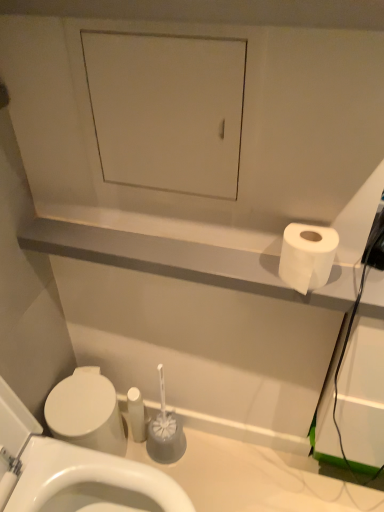
Image resolution: width=384 pixels, height=512 pixels. Identify the location of white matte toilet paper at right. (307, 256).

The height and width of the screenshot is (512, 384). Describe the element at coordinates (72, 472) in the screenshot. I see `white glossy toilet at lower left` at that location.

Where is `white matte toilet paper at right`? white matte toilet paper at right is located at coordinates [x=307, y=256].

Is white matte cabinet at upper center closer to camera compared to white glossy toilet at lower left?

No, white matte cabinet at upper center is further to the viewer.

How different are the orientations of white matte cabinet at upper center and white glossy toilet at lower left in degrees?

The angular difference between white matte cabinet at upper center and white glossy toilet at lower left is 90.8 degrees.

Which of these two, white matte cabinet at upper center or white glossy toilet at lower left, stands shorter?

white matte cabinet at upper center.

Measure the distance between white matte cabinet at upper center and white glossy toilet at lower left.

white matte cabinet at upper center and white glossy toilet at lower left are 26.21 inches apart from each other.

Is point (47, 451) positioned in front of point (179, 179)?

No, (47, 451) is behind (179, 179).

From a real-world perspective, between white glossy toilet at lower left and white matte cabinet at upper center, who is vertically lower?

From a 3D spatial view, white glossy toilet at lower left is below.

Who is shorter, white glossy toilet at lower left or white matte cabinet at upper center?

white matte cabinet at upper center.

Is white glossy toilet at lower left at the back of white matte toilet paper at right?

white matte toilet paper at right does not have its back to white glossy toilet at lower left.

From a real-world perspective, is white matte toilet paper at right below white glossy toilet at lower left?

No, from a real-world perspective, white matte toilet paper at right is not below white glossy toilet at lower left.

Is point (314, 258) closer or farther from the camera than point (125, 474)?

Point (314, 258) is closer to the camera than point (125, 474).

I want to click on toilet paper that is on the right side of white glossy toilet at lower left, so click(x=307, y=256).

Is white glossy toilet at lower left next to white matte toilet paper at right and touching it?

They are not placed beside each other.

Is white glossy toilet at lower left positioned with its back to white matte toilet paper at right?

No, white glossy toilet at lower left is not facing away from white matte toilet paper at right.

From a real-world perspective, which object rests below the other?

white glossy toilet at lower left, from a real-world perspective.

In terms of size, does white glossy toilet at lower left appear bigger or smaller than white matte toilet paper at right?

white glossy toilet at lower left is bigger than white matte toilet paper at right.

Can you see white matte cabinet at upper center touching white matte toilet paper at right?

No, white matte cabinet at upper center is not touching white matte toilet paper at right.

Considering their positions, is white matte cabinet at upper center located in front of or behind white matte toilet paper at right?

Clearly, white matte cabinet at upper center is in front of white matte toilet paper at right.

Considering the relative sizes of white matte cabinet at upper center and white matte toilet paper at right in the image provided, is white matte cabinet at upper center shorter than white matte toilet paper at right?

In fact, white matte cabinet at upper center may be taller than white matte toilet paper at right.

Considering the sizes of objects white matte toilet paper at right and white matte cabinet at upper center in the image provided, who is smaller, white matte toilet paper at right or white matte cabinet at upper center?

white matte toilet paper at right is smaller.

From the image's perspective, between white matte toilet paper at right and white matte cabinet at upper center, who is located below?

white matte toilet paper at right, from the image's perspective.

How different are the orientations of white matte toilet paper at right and white matte cabinet at upper center in degrees?

The angle between the facing direction of white matte toilet paper at right and the facing direction of white matte cabinet at upper center is 0.796 degrees.

Is white matte toilet paper at right closer to camera compared to white matte cabinet at upper center?

No, it is not.

At what (x,y) coordinates should I click in order to perform the action: click on medicine cabinet on the right of the white glossy toilet at lower left. Please return your answer as a coordinate pair (x, y). The height and width of the screenshot is (512, 384). Looking at the image, I should click on (167, 110).

What are the coordinates of `toilet located below the white matte cabinet at upper center (from the image's perspective)` in the screenshot? It's located at (72, 472).

When comparing their distances from white matte toilet paper at right, does white glossy toilet at lower left or white matte cabinet at upper center seem further?

Among the two, white glossy toilet at lower left is located further to white matte toilet paper at right.

Based on their spatial positions, is white matte cabinet at upper center or white matte toilet paper at right closer to white glossy toilet at lower left?

Among the two, white matte toilet paper at right is located nearer to white glossy toilet at lower left.

When comparing their distances from white matte toilet paper at right, does white matte cabinet at upper center or white glossy toilet at lower left seem further?

white glossy toilet at lower left lies further to white matte toilet paper at right than the other object.

Looking at the image, which one is located further to white glossy toilet at lower left, white matte toilet paper at right or white matte cabinet at upper center?

white matte cabinet at upper center is positioned further to the anchor white glossy toilet at lower left.

When comparing their distances from white matte cabinet at upper center, does white glossy toilet at lower left or white matte toilet paper at right seem closer?

white matte toilet paper at right is closer to white matte cabinet at upper center.

Looking at the image, which one is located closer to white matte cabinet at upper center, white matte toilet paper at right or white glossy toilet at lower left?

Among the two, white matte toilet paper at right is located nearer to white matte cabinet at upper center.

This screenshot has width=384, height=512. Identify the location of toilet paper between white matte cabinet at upper center and white glossy toilet at lower left in the up-down direction. (307, 256).